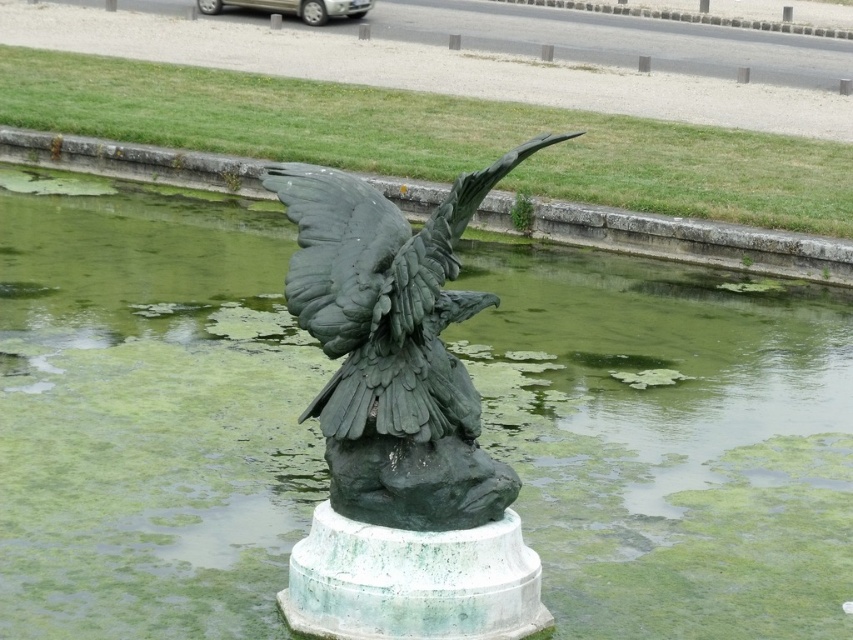
You are standing in front of the bronze sculpture of a bird in the water feature. There are two points marked on the sculpture. The first point is at coordinate point (654, 330) and the second is at point (345, 326). If you were to touch both points with your finger, which point would require your hand to be closer to the sculpture?

Point (345, 326) would require your hand to be closer to the sculpture because it is closer to the camera than point (654, 330).

You are standing in front of the sculpture and want to step onto the green patina eagle at center. Is the green algae water at center on the same side as your left or right side when facing the eagle?

The green algae water at center is positioned on the right side of green patina eagle at center, so when facing the eagle, the green algae water at center would be on your right side.